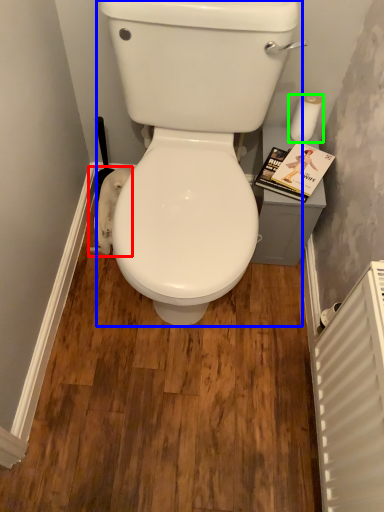
Question: Which object is positioned closest to toilet paper (highlighted by a red box)? Select from porcelain (highlighted by a blue box) and toilet paper (highlighted by a green box).

Choices:
 (A) porcelain
 (B) toilet paper

Answer: (A)